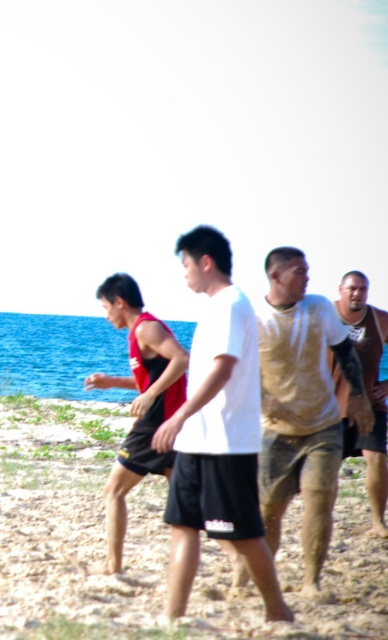
You are standing at the beach and see two points marked in the image. Which point is closer to you, point (228,372) or point (384,504)?

Point (228,372) is closer to the viewer than point (384,504).